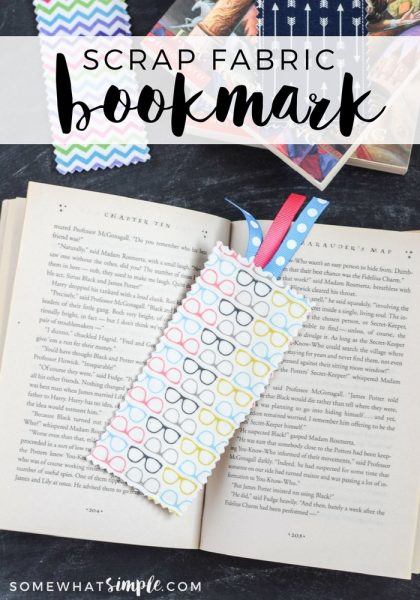
Locate an element on the screen. The height and width of the screenshot is (600, 420). book is located at coordinates coord(296,474).